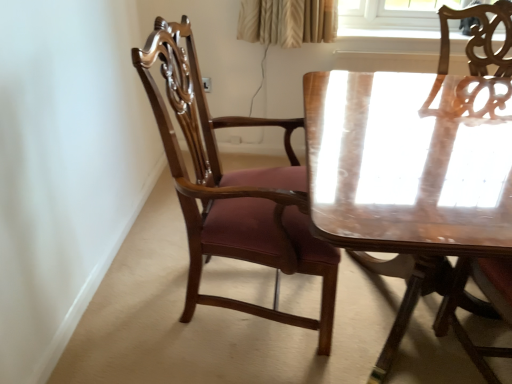
Describe the element at coordinates (233, 189) in the screenshot. This screenshot has width=512, height=384. I see `mahogany wood chair at center` at that location.

You are a GUI agent. You are given a task and a screenshot of the screen. Output one action in this format:
    pyautogui.click(x=<x>, y=<y>)
    Task: Click on the mahogany wood chair at center
    Image resolution: width=512 pixels, height=384 pixels.
    Given the screenshot: What is the action you would take?
    pyautogui.click(x=233, y=189)

Locate an element on the screen. The height and width of the screenshot is (384, 512). mahogany wood chair at center is located at coordinates (233, 189).